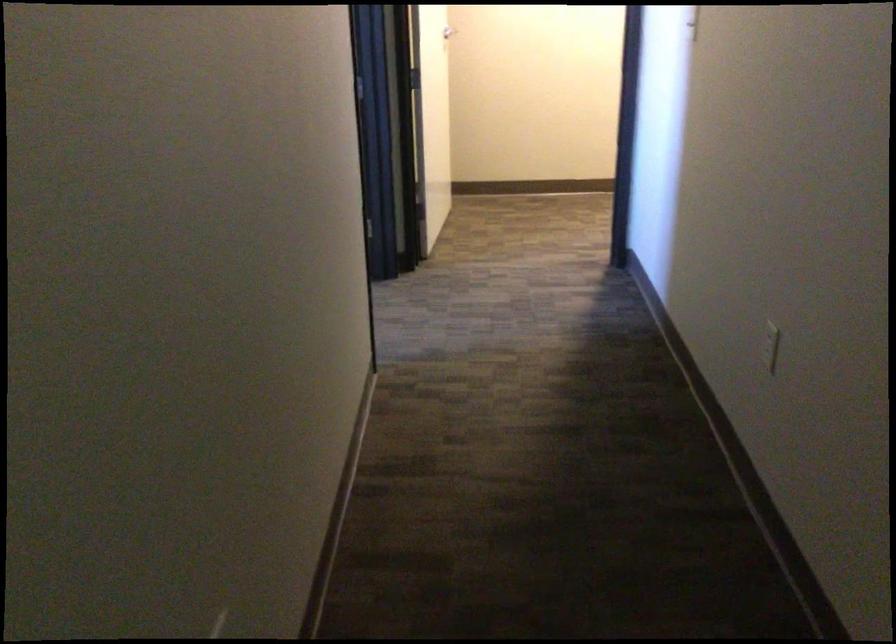
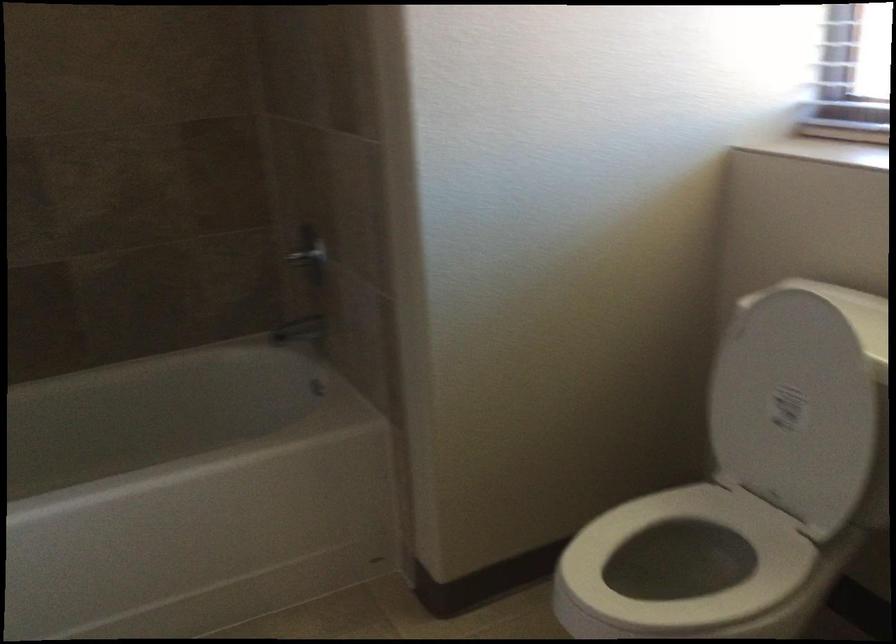
First-person continuous shooting, in which direction is the camera rotating?

The camera rotated toward right-down.